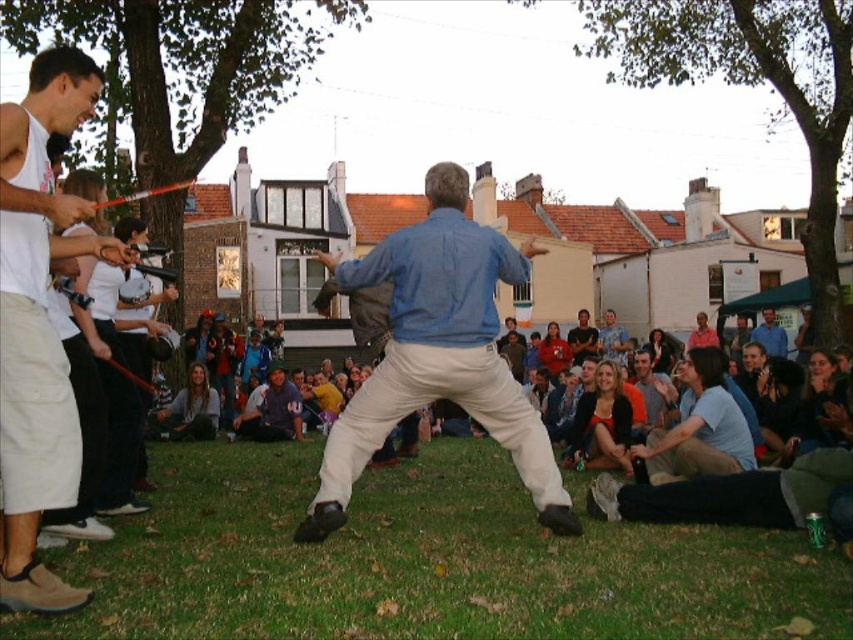
You are a costume designer preparing for a play. You have two shirts available for the lead actor who needs a loose, flowing costume. Which shirt from the image would you choose between the blue cotton shirt at center and the white cotton tank top at left?

The blue cotton shirt at center has a larger width than the white cotton tank top at left, making it the better choice for a loose, flowing costume.

You are a photographer standing in the scene and want to take a photo of the green grass at lower center and the white cotton tank top at left. Which object is located to the right of the other?

The green grass at lower center is positioned on the right side of white cotton tank top at left.

You are standing in the outdoor area where the sword demonstration is taking place. You notice two points marked in the scene. The first point is at coordinates point (517, 490) and the second is at point (85, 67). Which of these two points is closer to you?

Point (85, 67) is closer to you because it is less further to the viewer than point (517, 490).